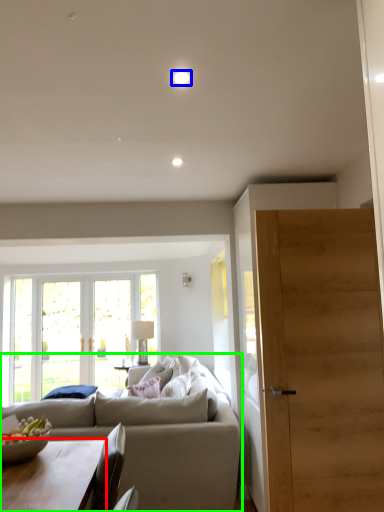
Question: Which object is the closest to the coffee table (highlighted by a red box)? Choose among these: light (highlighted by a blue box) or studio couch (highlighted by a green box).

Choices:
 (A) light
 (B) studio couch

Answer: (B)